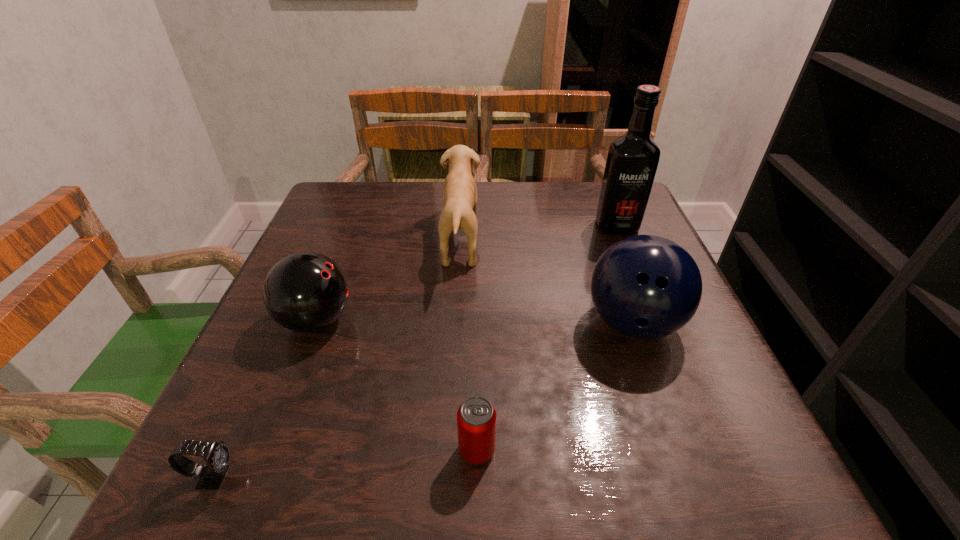
Find the location of `free space located on the surface of the left bowling ball near the finger holes`. free space located on the surface of the left bowling ball near the finger holes is located at coordinates point(437,320).

Where is `vacant space positioned 0.130m on the right of the fifth tallest object`? The width and height of the screenshot is (960, 540). vacant space positioned 0.130m on the right of the fifth tallest object is located at coordinates (583, 450).

This screenshot has width=960, height=540. In order to click on free region located 0.330m on the face of the shortest object in this screenshot , I will do `click(469, 476)`.

Where is `liquor located at the far edge`? liquor located at the far edge is located at coordinates (632, 160).

Identify the location of puppy situated at the far edge. The width and height of the screenshot is (960, 540). (459, 192).

Find the location of `can at the near edge`. can at the near edge is located at coordinates (476, 418).

I want to click on watch at the near edge, so click(x=217, y=456).

Image resolution: width=960 pixels, height=540 pixels. I want to click on bowling ball present at the left edge, so pyautogui.click(x=304, y=292).

Where is `watch positioned at the left edge`? The height and width of the screenshot is (540, 960). watch positioned at the left edge is located at coordinates pos(217,456).

Find the location of a particular element. This screenshot has width=960, height=540. liquor that is at the right edge is located at coordinates (632, 160).